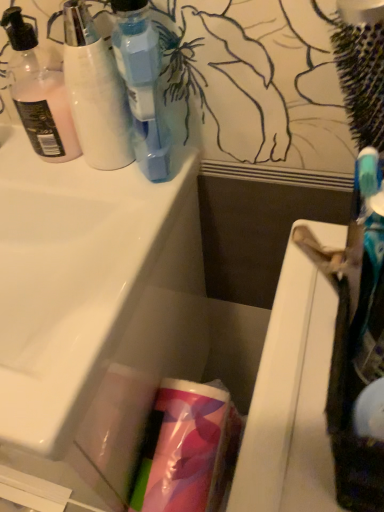
Question: Considering the relative sizes of translucent plastic bottle at upper left, the 2th bottle positioned from the left, and transparent plastic bottle at upper left, which is the 3th bottle in left-to-right order, in the image provided, is translucent plastic bottle at upper left, the 2th bottle positioned from the left, thinner than transparent plastic bottle at upper left, which is the 3th bottle in left-to-right order,?

Choices:
 (A) yes
 (B) no

Answer: (A)

Question: Is translucent plastic bottle at upper left, the 2th bottle positioned from the left, in contact with transparent plastic bottle at upper left, which is the 3th bottle in left-to-right order?

Choices:
 (A) no
 (B) yes

Answer: (B)

Question: From the image's perspective, is translucent plastic bottle at upper left, which is the second bottle from right to left, located beneath transparent plastic bottle at upper left, which is the 3th bottle in left-to-right order?

Choices:
 (A) yes
 (B) no

Answer: (B)

Question: Considering the relative positions of translucent plastic bottle at upper left, the 2th bottle positioned from the left, and transparent plastic bottle at upper left, which is the 3th bottle in left-to-right order, in the image provided, is translucent plastic bottle at upper left, the 2th bottle positioned from the left, to the right of transparent plastic bottle at upper left, which is the 3th bottle in left-to-right order, from the viewer's perspective?

Choices:
 (A) no
 (B) yes

Answer: (A)

Question: Considering the relative sizes of translucent plastic bottle at upper left, which is the second bottle from right to left, and transparent plastic bottle at upper left, the 1th bottle from the right, in the image provided, is translucent plastic bottle at upper left, which is the second bottle from right to left, bigger than transparent plastic bottle at upper left, the 1th bottle from the right,?

Choices:
 (A) no
 (B) yes

Answer: (A)

Question: Is translucent plastic bottle at upper left, the 2th bottle positioned from the left, taller than transparent plastic bottle at upper left, which is the 3th bottle in left-to-right order?

Choices:
 (A) no
 (B) yes

Answer: (A)

Question: Is translucent plastic roll at center outside of transparent plastic bottle at upper left, which is the 3th bottle in left-to-right order?

Choices:
 (A) no
 (B) yes

Answer: (B)

Question: Considering the relative sizes of translucent plastic roll at center and transparent plastic bottle at upper left, which is the 3th bottle in left-to-right order, in the image provided, is translucent plastic roll at center bigger than transparent plastic bottle at upper left, which is the 3th bottle in left-to-right order,?

Choices:
 (A) yes
 (B) no

Answer: (A)

Question: Considering the relative sizes of translucent plastic roll at center and transparent plastic bottle at upper left, the 1th bottle from the right, in the image provided, is translucent plastic roll at center shorter than transparent plastic bottle at upper left, the 1th bottle from the right,?

Choices:
 (A) yes
 (B) no

Answer: (B)

Question: From the image's perspective, is translucent plastic roll at center over transparent plastic bottle at upper left, which is the 3th bottle in left-to-right order?

Choices:
 (A) yes
 (B) no

Answer: (B)

Question: From a real-world perspective, is translucent plastic roll at center under transparent plastic bottle at upper left, the 1th bottle from the right?

Choices:
 (A) yes
 (B) no

Answer: (A)

Question: Does translucent plastic roll at center appear on the right side of transparent plastic bottle at upper left, the 1th bottle from the right?

Choices:
 (A) yes
 (B) no

Answer: (A)

Question: Does translucent pink lotion at left, which is the first bottle in left-to-right order, have a larger size compared to white glossy sink at center?

Choices:
 (A) no
 (B) yes

Answer: (A)